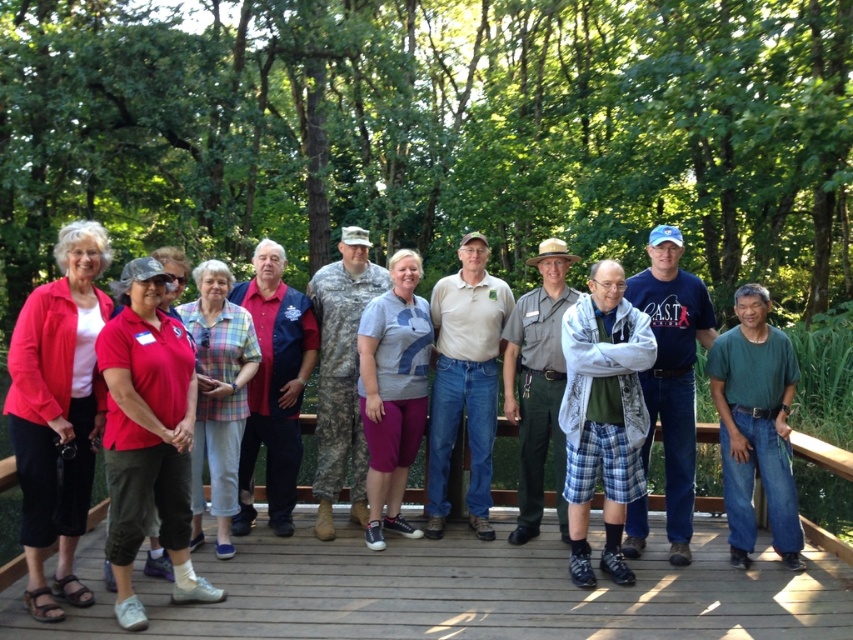
Question: From the image, what is the correct spatial relationship of gray cotton t-shirt at center in relation to khaki uniform at center?

Choices:
 (A) above
 (B) below

Answer: (B)

Question: Which point is farther from the camera taking this photo?

Choices:
 (A) (271, 481)
 (B) (376, 333)
 (C) (71, 536)

Answer: (A)

Question: Does matte red shirt at center have a larger size compared to white cotton shirt at center?

Choices:
 (A) yes
 (B) no

Answer: (A)

Question: Is red polyester shirt at center thinner than khaki uniform at center?

Choices:
 (A) no
 (B) yes

Answer: (A)

Question: Which is nearer to the khaki uniform at center?

Choices:
 (A) plaid cotton shorts at center
 (B) matte red shirt at center

Answer: (A)

Question: Which point is farther from the camera taking this photo?

Choices:
 (A) click(643, 390)
 (B) click(85, 416)
 (C) click(575, 460)
 (D) click(326, 515)

Answer: (D)